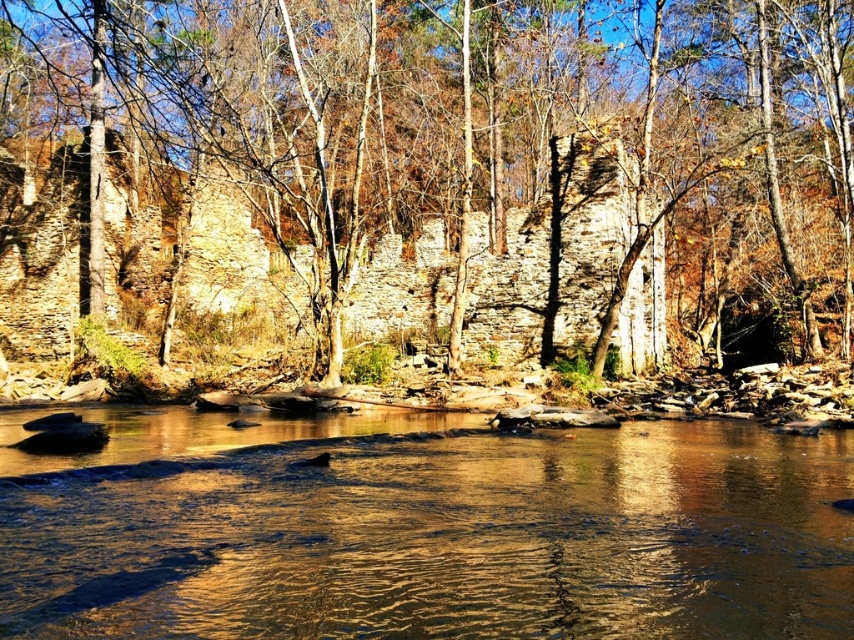
Question: Does smooth bark tree at center have a smaller size compared to golden reflective water at center?

Choices:
 (A) yes
 (B) no

Answer: (B)

Question: Is smooth bark tree at center in front of golden reflective water at center?

Choices:
 (A) no
 (B) yes

Answer: (A)

Question: Which point is closer to the camera?

Choices:
 (A) (7, 307)
 (B) (598, 568)

Answer: (B)

Question: Which point is closer to the camera?

Choices:
 (A) (85, 12)
 (B) (449, 634)

Answer: (B)

Question: Does smooth bark tree at center appear on the left side of golden reflective water at center?

Choices:
 (A) yes
 (B) no

Answer: (A)